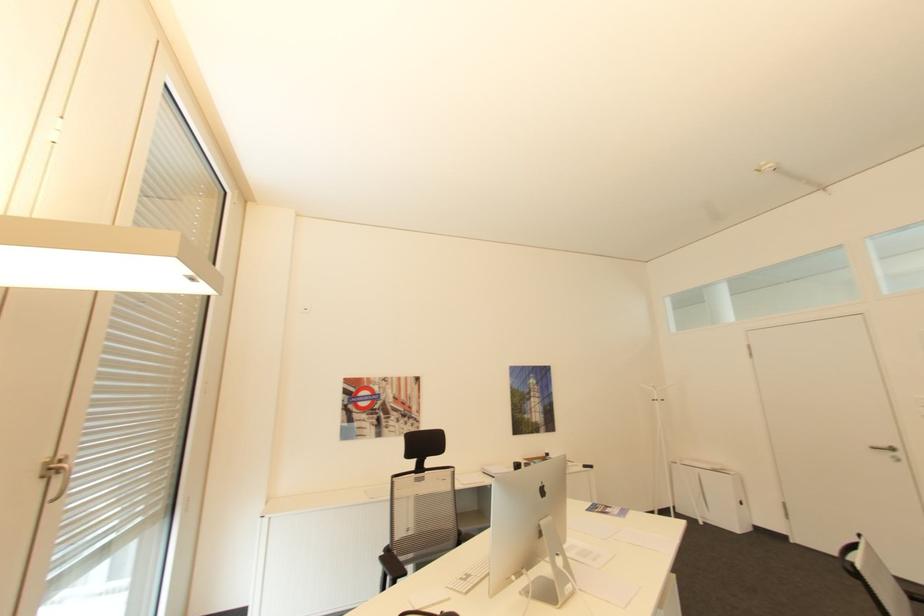
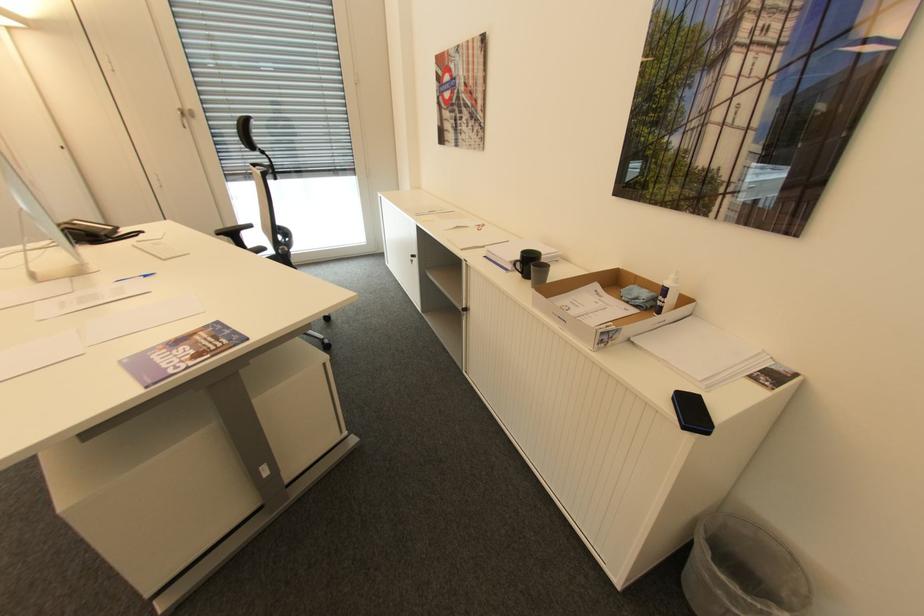
In the second image, find the point that corresponds to [553,454] in the first image.

(670, 291)